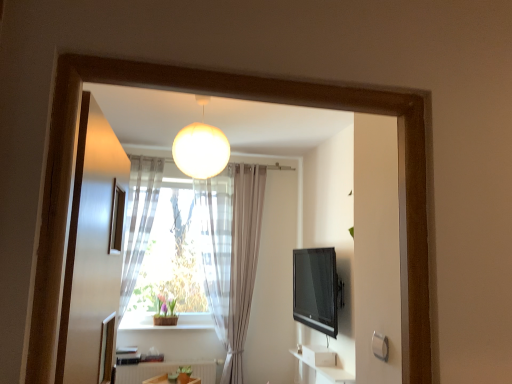
Question: Is matte glass globe at upper center to the right of white matte radiator at lower center from the viewer's perspective?

Choices:
 (A) no
 (B) yes

Answer: (B)

Question: Is matte glass globe at upper center oriented away from white matte radiator at lower center?

Choices:
 (A) no
 (B) yes

Answer: (A)

Question: Does matte glass globe at upper center appear on the left side of white matte radiator at lower center?

Choices:
 (A) yes
 (B) no

Answer: (B)

Question: Can you confirm if matte glass globe at upper center is smaller than white matte radiator at lower center?

Choices:
 (A) no
 (B) yes

Answer: (A)

Question: Is matte glass globe at upper center far from white matte radiator at lower center?

Choices:
 (A) no
 (B) yes

Answer: (B)

Question: Considering the relative positions of matte glass globe at upper center and translucent fabric curtain at center, the second curtain in the right-to-left sequence, in the image provided, is matte glass globe at upper center to the left or to the right of translucent fabric curtain at center, the second curtain in the right-to-left sequence,?

Choices:
 (A) left
 (B) right

Answer: (B)

Question: From the image's perspective, is matte glass globe at upper center positioned above or below translucent fabric curtain at center, the second curtain in the right-to-left sequence?

Choices:
 (A) above
 (B) below

Answer: (A)

Question: Is point coord(214,160) positioned closer to the camera than point coord(138,206)?

Choices:
 (A) closer
 (B) farther

Answer: (A)

Question: Is matte glass globe at upper center wider or thinner than translucent fabric curtain at center, which is counted as the first curtain, starting from the left?

Choices:
 (A) wide
 (B) thin

Answer: (A)

Question: Considering the relative positions of white sheer curtain at center, which is counted as the 2th curtain, starting from the left, and white matte radiator at lower center in the image provided, is white sheer curtain at center, which is counted as the 2th curtain, starting from the left, to the left or to the right of white matte radiator at lower center?

Choices:
 (A) left
 (B) right

Answer: (B)

Question: Choose the correct answer: Is white sheer curtain at center, which is counted as the 2th curtain, starting from the left, inside white matte radiator at lower center or outside it?

Choices:
 (A) inside
 (B) outside

Answer: (B)

Question: Considering the positions of white sheer curtain at center, which is counted as the 2th curtain, starting from the left, and white matte radiator at lower center in the image, is white sheer curtain at center, which is counted as the 2th curtain, starting from the left, wider or thinner than white matte radiator at lower center?

Choices:
 (A) thin
 (B) wide

Answer: (B)

Question: From a real-world perspective, relative to white matte radiator at lower center, is white sheer curtain at center, the first curtain when ordered from right to left, vertically above or below?

Choices:
 (A) above
 (B) below

Answer: (A)

Question: Do you think black glossy tv at right is within matte glass globe at upper center, or outside of it?

Choices:
 (A) inside
 (B) outside

Answer: (B)

Question: Relative to matte glass globe at upper center, is black glossy tv at right in front or behind?

Choices:
 (A) front
 (B) behind

Answer: (B)